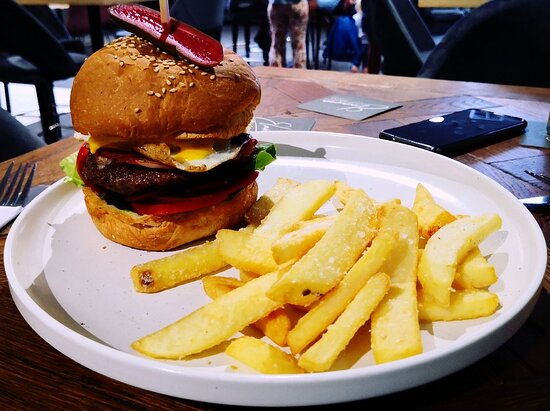
The image size is (550, 411). I want to click on table, so click(x=276, y=95).